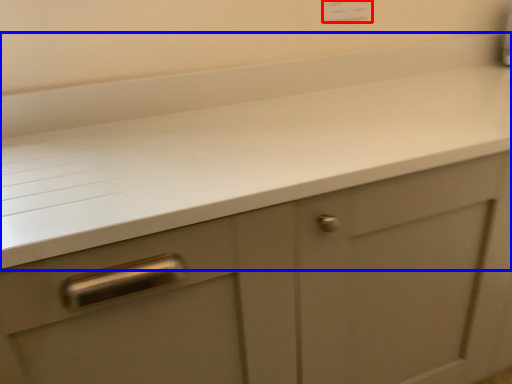
Question: Which of the following is the farthest to the observer, electric outlet (highlighted by a red box) or countertop (highlighted by a blue box)?

Choices:
 (A) electric outlet
 (B) countertop

Answer: (A)